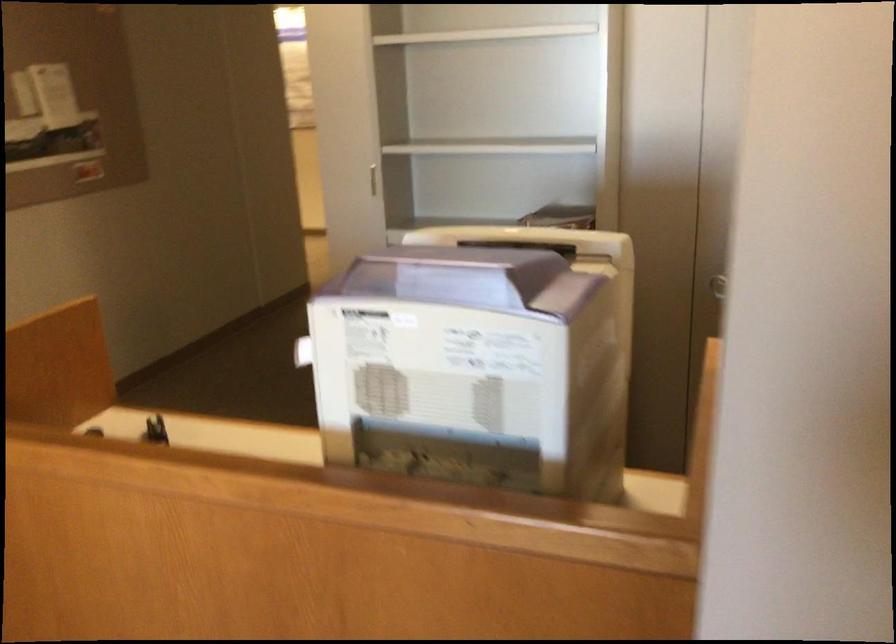
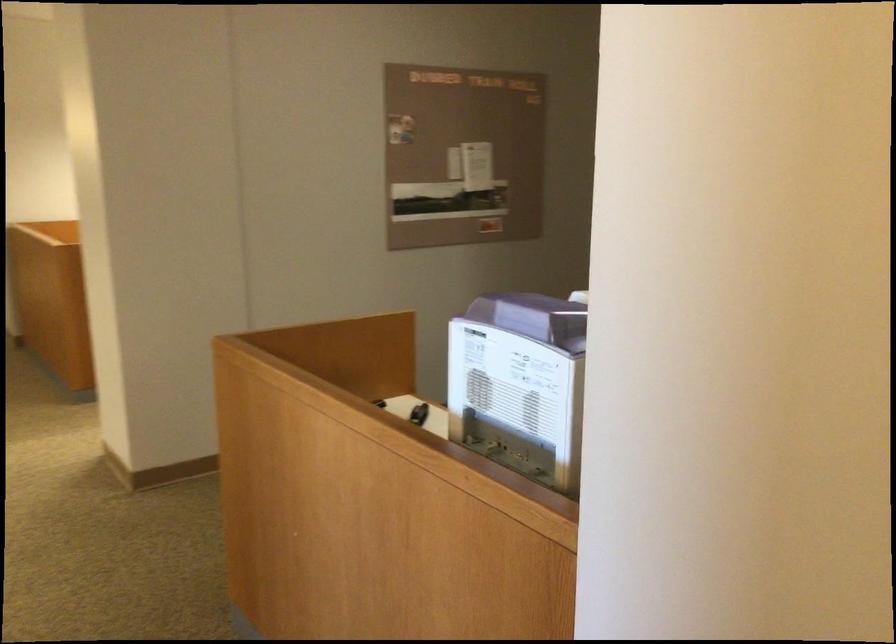
Question: Based on the continuous images, in which direction is the camera rotating? Reply with the corresponding letter.

Choices:
 (A) Left
 (B) Right
 (C) Up
 (D) Down

Answer: (A)